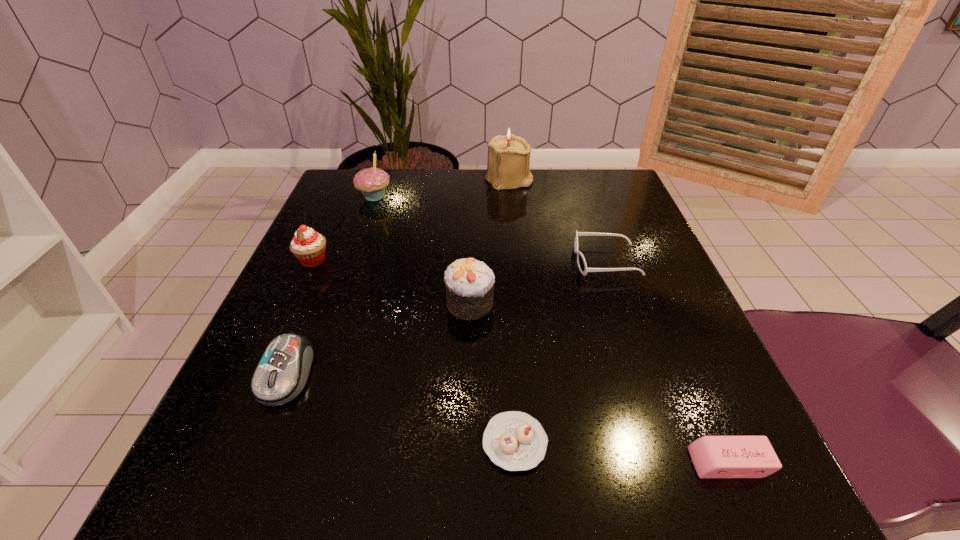
Identify the location of vacant space that's between the nearest cupcake and the third cupcake from right to left. The width and height of the screenshot is (960, 540). (444, 320).

Find the location of a particular element. free point between the sunglasses and the nearest cupcake is located at coordinates (561, 352).

The height and width of the screenshot is (540, 960). Find the location of `unoccupied position between the nearest cupcake and the candle_holder`. unoccupied position between the nearest cupcake and the candle_holder is located at coordinates (512, 311).

Find the location of a particular element. The height and width of the screenshot is (540, 960). object that is the third closest to the eraser is located at coordinates (469, 283).

Select which object appears as the closest to the tallest cupcake. Please provide its 2D coordinates. Your answer should be formatted as a tuple, i.e. [(x, y)], where the tuple contains the x and y coordinates of a point satisfying the conditions above.

[(308, 246)]

Locate which cupcake is the closest to the tallest object. Please provide its 2D coordinates. Your answer should be formatted as a tuple, i.e. [(x, y)], where the tuple contains the x and y coordinates of a point satisfying the conditions above.

[(372, 182)]

This screenshot has height=540, width=960. What are the coordinates of `cupcake that can be found as the third closest to the leftmost cupcake` in the screenshot? It's located at (515, 441).

Locate an element on the screen. Image resolution: width=960 pixels, height=540 pixels. free spot that satisfies the following two spatial constraints: 1. on the front side of the tallest cupcake; 2. on the right side of the eraser is located at coordinates (281, 463).

At what (x,y) coordinates should I click in order to perform the action: click on free space that satisfies the following two spatial constraints: 1. on the front side of the eraser; 2. on the right side of the second nearest cupcake. Please return your answer as a coordinate pair (x, y). Looking at the image, I should click on point(467,463).

Find the location of `vacant space that satisfies the following two spatial constraints: 1. on the front side of the farthest cupcake; 2. on the left side of the eraser`. vacant space that satisfies the following two spatial constraints: 1. on the front side of the farthest cupcake; 2. on the left side of the eraser is located at coordinates (281, 463).